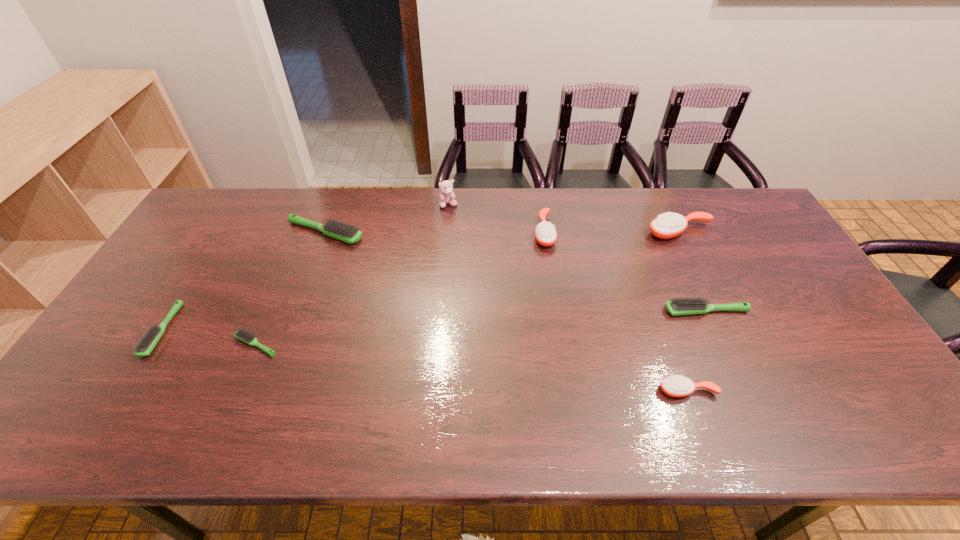
Locate an element on the screen. The width and height of the screenshot is (960, 540). unoccupied area between the second smallest light hairbrush and the tallest object is located at coordinates (305, 268).

At what (x,y) coordinates should I click in order to perform the action: click on vacant region between the biggest orange hairbrush and the farthest light hairbrush. Please return your answer as a coordinate pair (x, y). The height and width of the screenshot is (540, 960). Looking at the image, I should click on (502, 232).

Identify the location of vacant area that lies between the fifth object from left to right and the nearest object. The width and height of the screenshot is (960, 540). (615, 311).

Locate an element on the screen. Image resolution: width=960 pixels, height=540 pixels. free space between the second tallest object and the farthest light hairbrush is located at coordinates (502, 232).

This screenshot has height=540, width=960. In order to click on vacant region between the fourth object from right to left and the farthest object in this screenshot , I will do `click(496, 218)`.

Find the location of a particular element. The height and width of the screenshot is (540, 960). free spot between the second biggest light hairbrush and the leftmost light hairbrush is located at coordinates (434, 321).

Locate an element on the screen. the second closest object to the nearest hairbrush is located at coordinates (668, 225).

Identify the location of the second closest object to the smallest orange hairbrush. The height and width of the screenshot is (540, 960). (668, 225).

The width and height of the screenshot is (960, 540). What are the coordinates of `hairbrush identified as the third closest to the second tallest object` in the screenshot? It's located at (675, 386).

The image size is (960, 540). I want to click on hairbrush identified as the fourth closest to the smallest orange hairbrush, so click(348, 233).